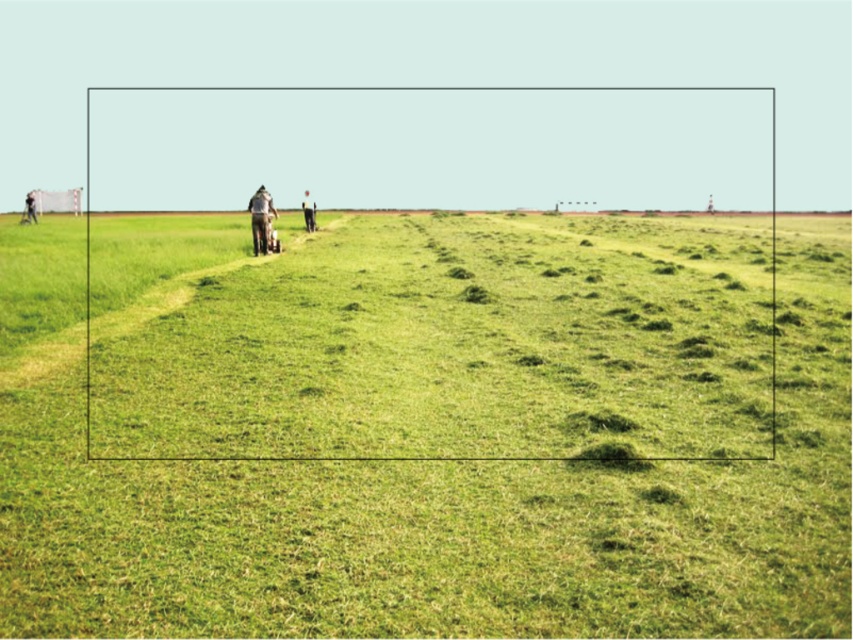
Question: Is dark gray fabric jacket at center below light brown fabric jacket at center?

Choices:
 (A) yes
 (B) no

Answer: (A)

Question: Can you confirm if dark gray fabric jacket at center is thinner than light brown fabric jacket at center?

Choices:
 (A) yes
 (B) no

Answer: (A)

Question: Is green grass at center to the right of dark gray fabric jacket at center from the viewer's perspective?

Choices:
 (A) yes
 (B) no

Answer: (A)

Question: Which of the following is the closest to the observer?

Choices:
 (A) 26,220
 (B) 306,218

Answer: (B)

Question: Based on their relative distances, which object is nearer to the dark gray fabric jacket at center?

Choices:
 (A) light brown fabric jacket at center
 (B) smooth skin person at left
 (C) green grass at center

Answer: (C)

Question: Which point appears farthest from the camera in this image?

Choices:
 (A) (24, 218)
 (B) (309, 228)
 (C) (248, 202)
 (D) (398, 596)

Answer: (A)